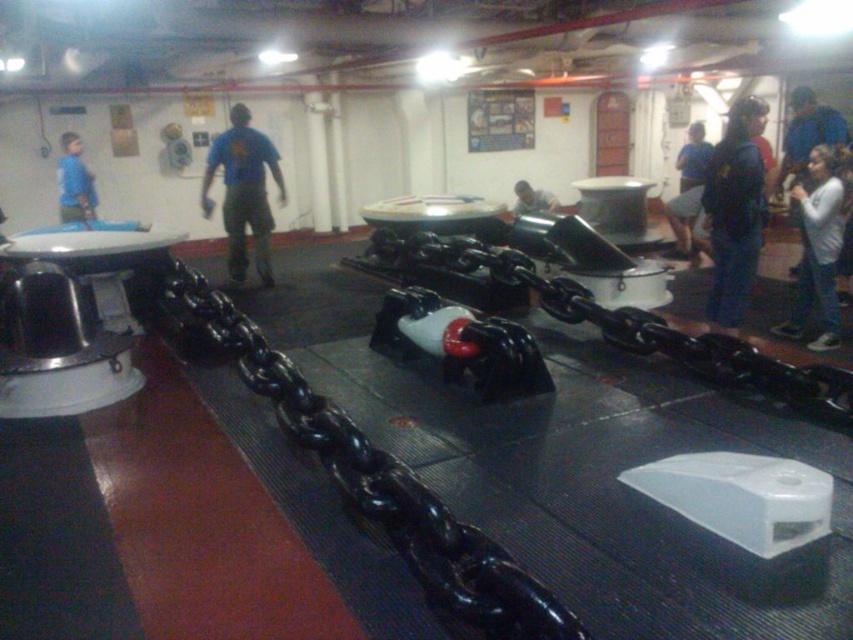
You are a maintenance worker in the engine room. You need to inspect both the black glossy chain at center and the matte black helmet at center. Which object should you check first based on their positions?

The black glossy chain at center should be checked first since it is closer to the viewer than the matte black helmet at center.

You are a maintenance worker carrying a tool box that is 2 meters long. You need to walk from the camera position to the back of the room. Is the black glossy chain at center in your way?

The black glossy chain at center is 1.81 meters from the camera, which is closer than the 2 meter length of your tool box. Therefore, the chain will be in your way as you walk from the camera position to the back of the room.

You are standing in the ship engine room and need to locate the blue denim jeans at right. According to the coordinates provided, where exactly should you look?

The blue denim jeans at right can be found at the coordinates point (x=734, y=211).